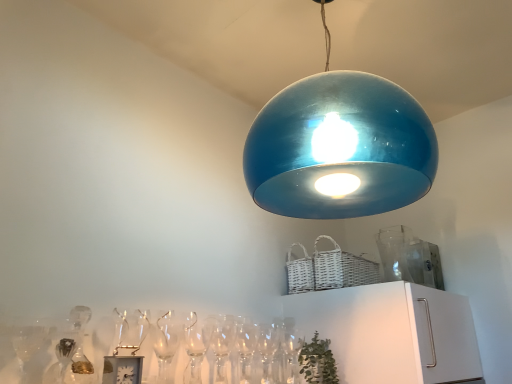
Question: Is white wicker basket at upper right aimed at glossy blue dome at upper center?

Choices:
 (A) yes
 (B) no

Answer: (B)

Question: From a real-world perspective, does white wicker basket at upper right stand above glossy blue dome at upper center?

Choices:
 (A) no
 (B) yes

Answer: (A)

Question: Does white wicker basket at upper right have a greater width compared to glossy blue dome at upper center?

Choices:
 (A) yes
 (B) no

Answer: (B)

Question: From a real-world perspective, is white wicker basket at upper right physically below glossy blue dome at upper center?

Choices:
 (A) no
 (B) yes

Answer: (B)

Question: Considering the relative positions of white wicker basket at upper right and glossy blue dome at upper center in the image provided, is white wicker basket at upper right to the right of glossy blue dome at upper center from the viewer's perspective?

Choices:
 (A) no
 (B) yes

Answer: (B)

Question: Looking at the image, does white wicker basket at upper right seem bigger or smaller compared to green leafy plant at lower center?

Choices:
 (A) big
 (B) small

Answer: (A)

Question: Considering the positions of white wicker basket at upper right and green leafy plant at lower center in the image, is white wicker basket at upper right taller or shorter than green leafy plant at lower center?

Choices:
 (A) short
 (B) tall

Answer: (B)

Question: Visually, is white wicker basket at upper right positioned to the left or to the right of green leafy plant at lower center?

Choices:
 (A) left
 (B) right

Answer: (B)

Question: Is point (348, 266) positioned closer to the camera than point (309, 372)?

Choices:
 (A) closer
 (B) farther

Answer: (B)

Question: Is glossy blue dome at upper center bigger or smaller than clear glass wine glass at lower center?

Choices:
 (A) small
 (B) big

Answer: (B)

Question: Relative to clear glass wine glass at lower center, is glossy blue dome at upper center in front or behind?

Choices:
 (A) front
 (B) behind

Answer: (A)

Question: Is point (336, 188) positioned closer to the camera than point (184, 342)?

Choices:
 (A) farther
 (B) closer

Answer: (A)

Question: From the image's perspective, is glossy blue dome at upper center positioned above or below clear glass wine glass at lower center?

Choices:
 (A) above
 (B) below

Answer: (A)

Question: Is glossy blue dome at upper center taller or shorter than green leafy plant at lower center?

Choices:
 (A) tall
 (B) short

Answer: (A)

Question: Visually, is glossy blue dome at upper center positioned to the left or to the right of green leafy plant at lower center?

Choices:
 (A) left
 (B) right

Answer: (B)